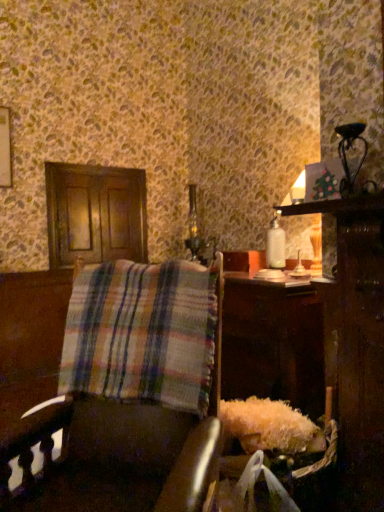
Question: Does point (59, 391) appear closer or farther from the camera than point (359, 124)?

Choices:
 (A) farther
 (B) closer

Answer: (B)

Question: Visually, is plaid fabric at left positioned to the left or to the right of metallic silver table lamp at upper right?

Choices:
 (A) left
 (B) right

Answer: (A)

Question: Which is nearer to the metallic silver table lamp at upper right?

Choices:
 (A) plaid fabric chair at center
 (B) plaid fabric at left

Answer: (B)

Question: Which is nearer to the plaid fabric chair at center?

Choices:
 (A) plaid fabric at left
 (B) metallic silver table lamp at upper right

Answer: (A)